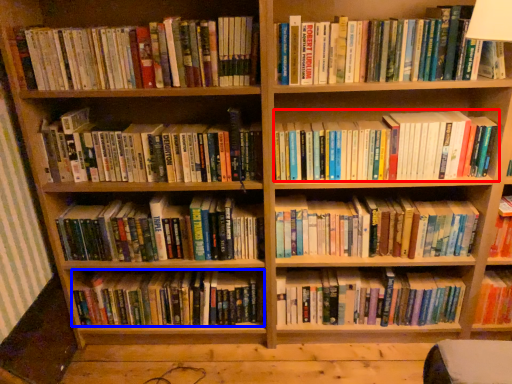
Question: Among these objects, which one is farthest to the camera, book (highlighted by a red box) or book (highlighted by a blue box)?

Choices:
 (A) book
 (B) book

Answer: (B)